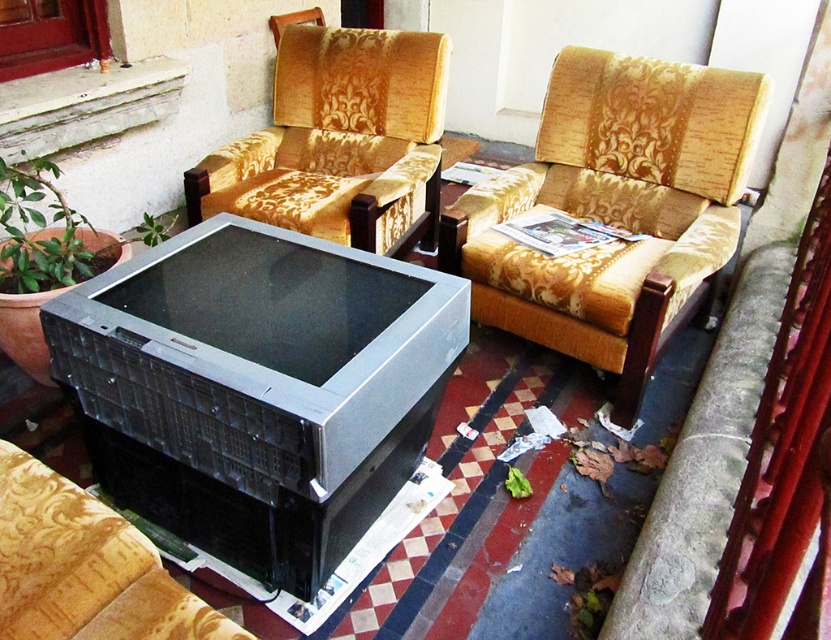
Question: Which of the following is the farthest from the observer?

Choices:
 (A) (488, 316)
 (B) (343, 38)

Answer: (B)

Question: Considering the relative positions of gold patterned armchair at upper center and black plastic tv at center in the image provided, where is gold patterned armchair at upper center located with respect to black plastic tv at center?

Choices:
 (A) below
 (B) above

Answer: (B)

Question: Which of the following is the farthest from the observer?

Choices:
 (A) black plastic tv at center
 (B) gold patterned armchair at upper center

Answer: (B)

Question: Can you confirm if gold patterned armchair at upper center is positioned below black plastic tv at center?

Choices:
 (A) yes
 (B) no

Answer: (B)

Question: Is gold patterned fabric armchair at center smaller than gold patterned armchair at upper center?

Choices:
 (A) no
 (B) yes

Answer: (A)

Question: Which is nearer to the gold patterned fabric armchair at center?

Choices:
 (A) gold patterned armchair at upper center
 (B) black plastic tv at center

Answer: (A)